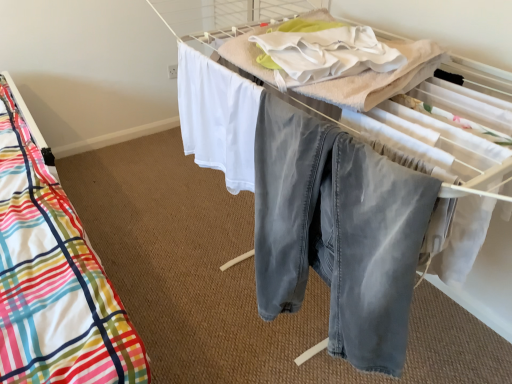
Question: From the image's perspective, is white cotton blanket at upper center below plaid fabric bed at left?

Choices:
 (A) no
 (B) yes

Answer: (A)

Question: Can you confirm if white cotton blanket at upper center is wider than plaid fabric bed at left?

Choices:
 (A) no
 (B) yes

Answer: (A)

Question: Is white cotton blanket at upper center further to camera compared to plaid fabric bed at left?

Choices:
 (A) no
 (B) yes

Answer: (A)

Question: Is white cotton blanket at upper center far away from plaid fabric bed at left?

Choices:
 (A) yes
 (B) no

Answer: (B)

Question: From a real-world perspective, is white cotton blanket at upper center positioned over plaid fabric bed at left based on gravity?

Choices:
 (A) no
 (B) yes

Answer: (B)

Question: From a real-world perspective, is white cotton blanket at upper center physically below plaid fabric bed at left?

Choices:
 (A) yes
 (B) no

Answer: (B)

Question: Does denim pants at center have a larger size compared to white cotton blanket at upper center?

Choices:
 (A) yes
 (B) no

Answer: (A)

Question: Is denim pants at center at the left side of white cotton blanket at upper center?

Choices:
 (A) yes
 (B) no

Answer: (A)

Question: Is denim pants at center positioned far away from white cotton blanket at upper center?

Choices:
 (A) no
 (B) yes

Answer: (A)

Question: Is denim pants at center closer to the viewer compared to white cotton blanket at upper center?

Choices:
 (A) no
 (B) yes

Answer: (B)

Question: Considering the relative sizes of denim pants at center and white cotton blanket at upper center in the image provided, is denim pants at center thinner than white cotton blanket at upper center?

Choices:
 (A) no
 (B) yes

Answer: (B)

Question: Is denim pants at center further to camera compared to white cotton blanket at upper center?

Choices:
 (A) no
 (B) yes

Answer: (A)

Question: From the image's perspective, is plaid fabric bed at left under denim pants at center?

Choices:
 (A) yes
 (B) no

Answer: (B)